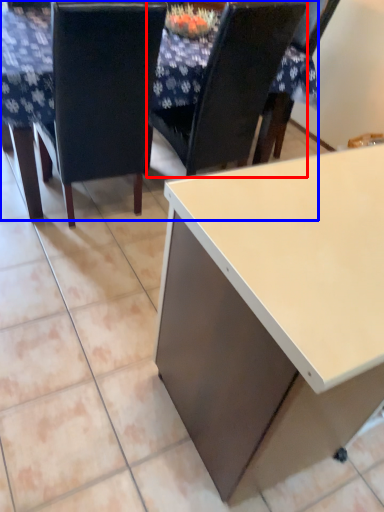
Question: Which point is closer to the camera, chair (highlighted by a red box) or table (highlighted by a blue box)?

Choices:
 (A) chair
 (B) table

Answer: (B)